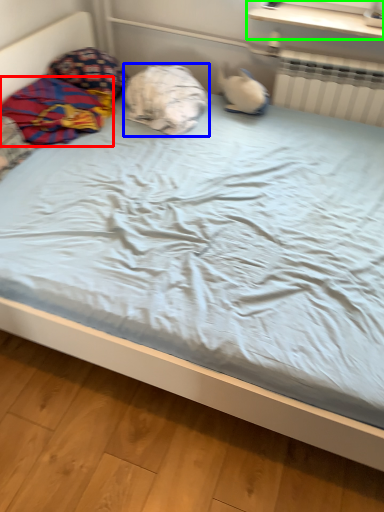
Question: Which object is the closest to the material (highlighted by a red box)? Choose among these: pillow (highlighted by a blue box) or window sill (highlighted by a green box).

Choices:
 (A) pillow
 (B) window sill

Answer: (A)